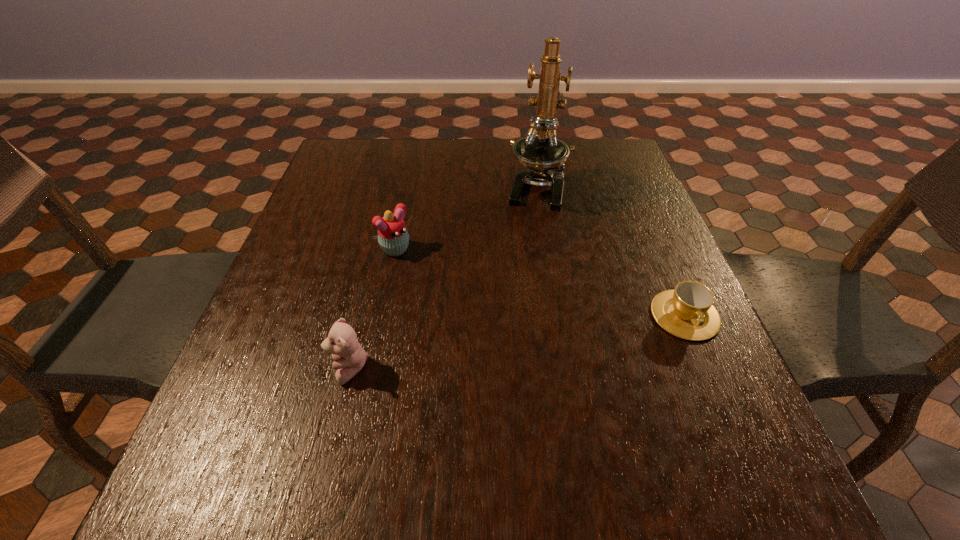
I want to click on vacant space on the desktop that is between the nearest object and the cup and is positioned at the eyepiece of the microscope, so click(x=505, y=344).

Where is `free space on the desktop that is between the teddy bear and the rightmost object and is positioned on the face of the second farthest object`? free space on the desktop that is between the teddy bear and the rightmost object and is positioned on the face of the second farthest object is located at coordinates point(507,344).